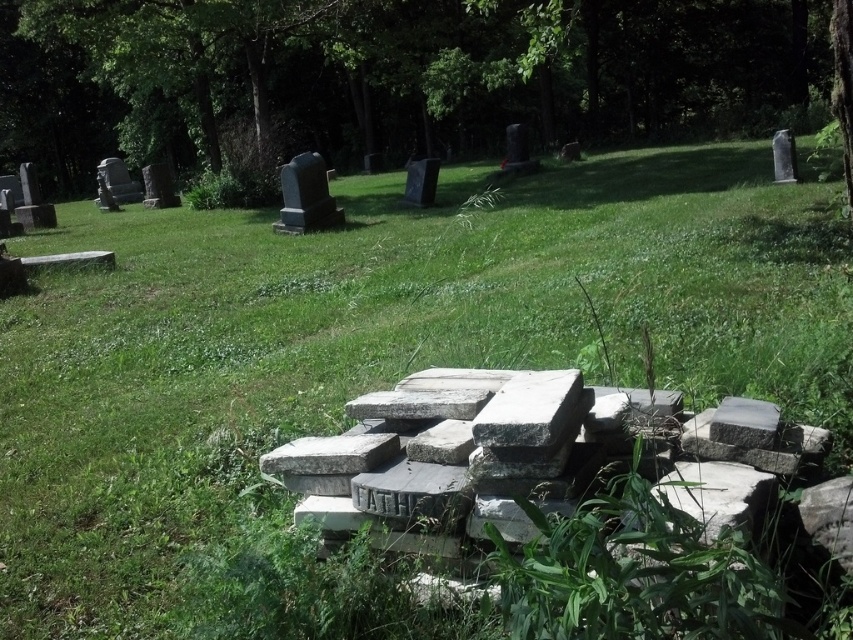
Question: Can you confirm if smooth gray gravestone at center is positioned below smooth gray tombstone at upper left?

Choices:
 (A) yes
 (B) no

Answer: (A)

Question: Based on their relative distances, which object is farther from the green leafy tree at upper center?

Choices:
 (A) smooth gray gravestone at center
 (B) smooth gray tombstone at upper left

Answer: (A)

Question: Which object is farther from the camera taking this photo?

Choices:
 (A) smooth gray gravestone at center
 (B) smooth gray stone at center
 (C) green leafy tree at upper center

Answer: (B)

Question: Can you confirm if green leafy tree at upper center is bigger than smooth gray tombstone at upper left?

Choices:
 (A) no
 (B) yes

Answer: (B)

Question: Which object appears farthest from the camera in this image?

Choices:
 (A) smooth gray stone at center
 (B) smooth gray tombstone at upper left

Answer: (B)

Question: Is green leafy tree at upper center thinner than smooth gray stone at center?

Choices:
 (A) yes
 (B) no

Answer: (B)